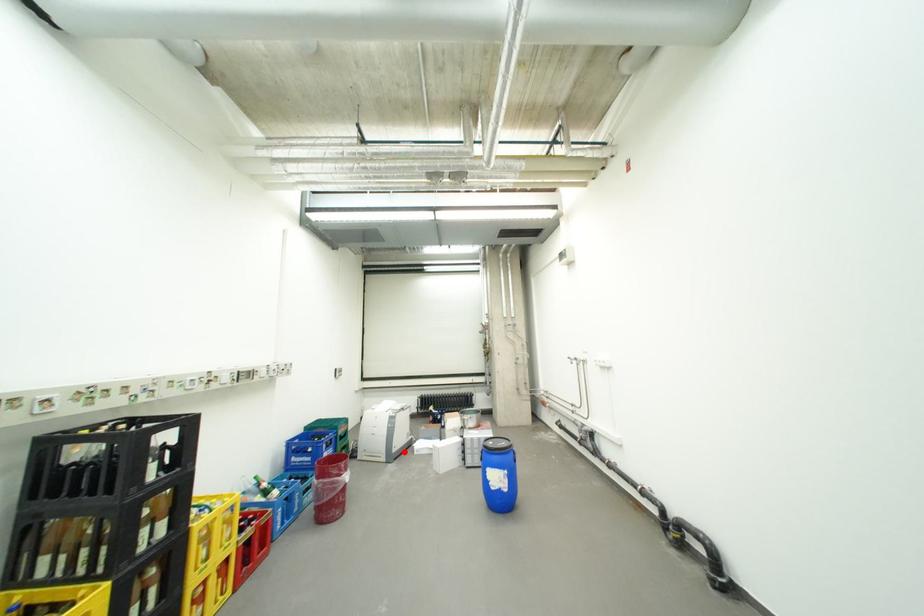
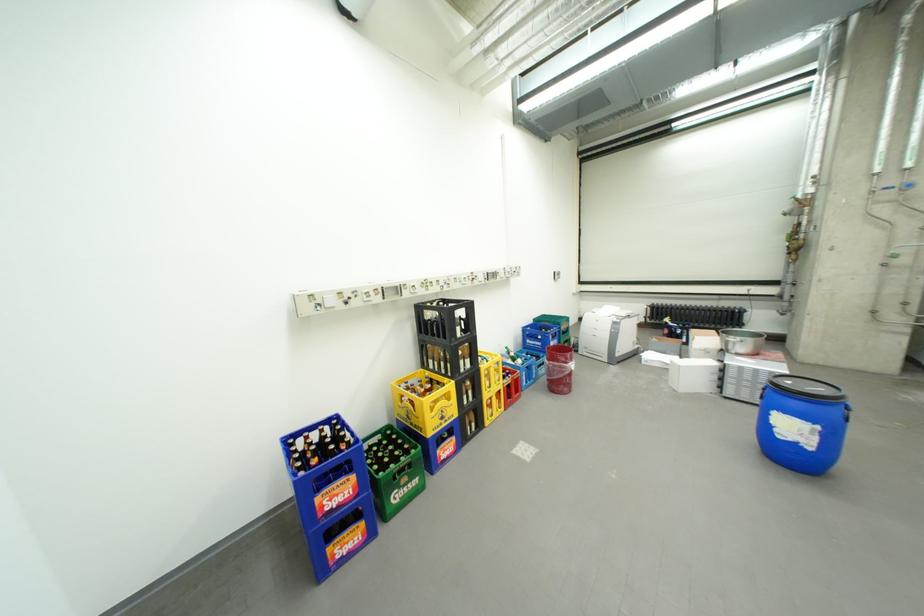
Locate, in the second image, the point that corresponds to the highlighted location in the first image.

(627, 355)